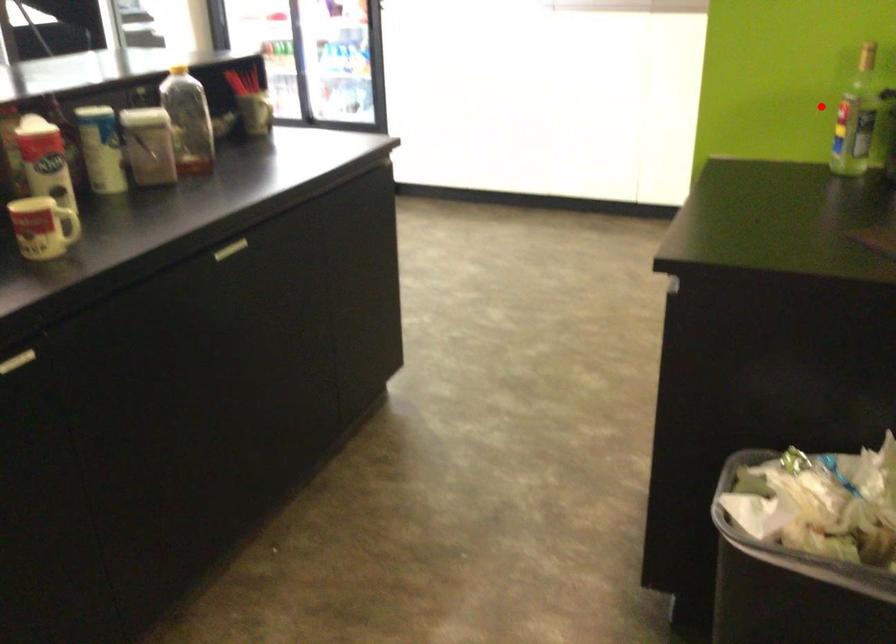
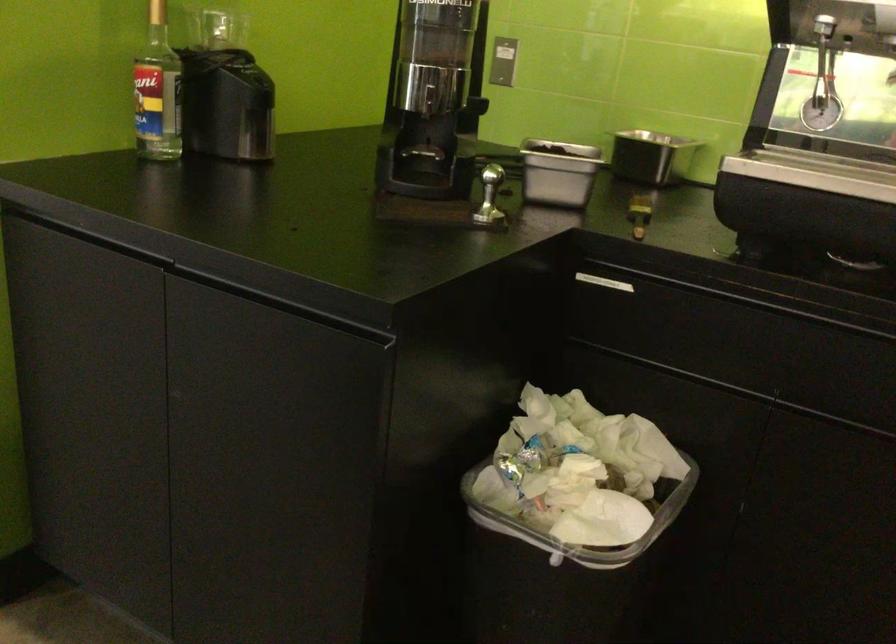
Question: I am providing you with two images of the same scene from different viewpoints. A red point is shown in image1. For the corresponding object point in image2, is it positioned nearer or farther from the camera?

Choices:
 (A) Nearer
 (B) Farther

Answer: (A)